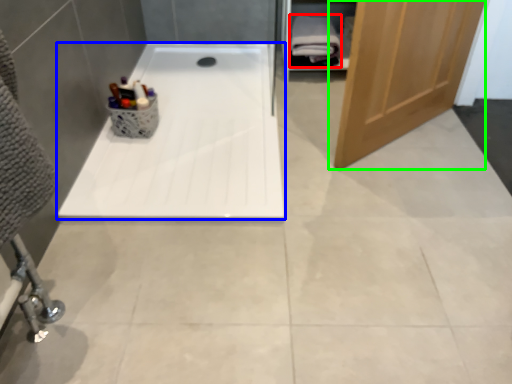
Question: Based on their relative distances, which object is nearer to bath towel (highlighted by a red box)? Choose from bathtub (highlighted by a blue box) and door (highlighted by a green box).

Choices:
 (A) bathtub
 (B) door

Answer: (A)